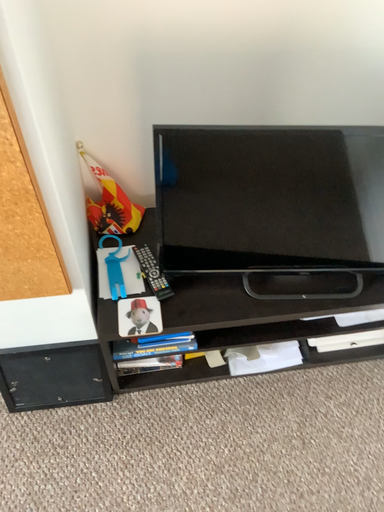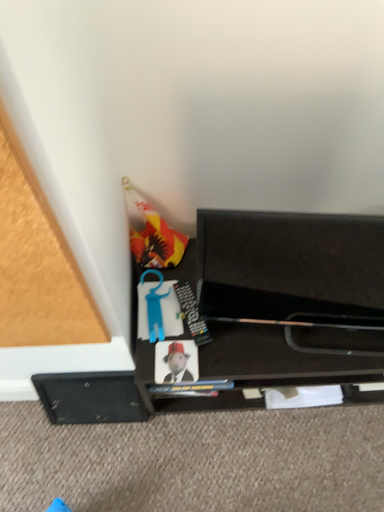
Question: Which way did the camera rotate in the video?

Choices:
 (A) rotated right
 (B) rotated left

Answer: (B)